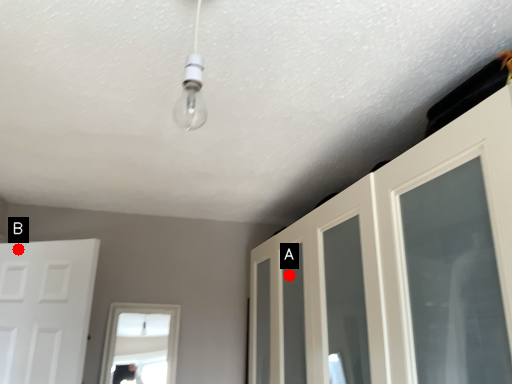
Question: Two points are circled on the image, labeled by A and B beside each circle. Which point is farther from the camera taking this photo?

Choices:
 (A) A is further
 (B) B is further

Answer: (B)